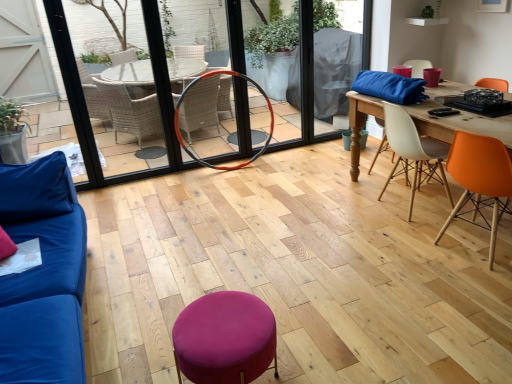
What do you see at coordinates (42, 275) in the screenshot? Image resolution: width=512 pixels, height=384 pixels. I see `blue fabric couch at left` at bounding box center [42, 275].

You are a GUI agent. You are given a task and a screenshot of the screen. Output one action in this format:
    pyautogui.click(x=<x>, y=<y>)
    Task: Click on the orange matte chair at right, which appears as the 2th chair when viewed from the back
    
    Given the screenshot: What is the action you would take?
    pyautogui.click(x=480, y=181)

What is the approximate width of orange matte chair at right, which appears as the 2th chair when viewed from the back?

orange matte chair at right, which appears as the 2th chair when viewed from the back, is 20.42 inches wide.

The image size is (512, 384). Describe the element at coordinates (413, 152) in the screenshot. I see `white plastic chair at center right, acting as the 1th chair starting from the back` at that location.

The image size is (512, 384). Describe the element at coordinates (119, 82) in the screenshot. I see `orange rubber hula hoop at center` at that location.

This screenshot has height=384, width=512. What are the coordinates of `blue fabric couch at left` in the screenshot? It's located at (42, 275).

From a real-world perspective, is purple fabric stool at center located beneath white plastic chair at center right, acting as the 1th chair starting from the back?

Indeed, from a real-world perspective, purple fabric stool at center is positioned beneath white plastic chair at center right, acting as the 1th chair starting from the back.

Considering the sizes of objects purple fabric stool at center and white plastic chair at center right, acting as the 1th chair starting from the back, in the image provided, who is wider, purple fabric stool at center or white plastic chair at center right, acting as the 1th chair starting from the back,?

Wider between the two is white plastic chair at center right, acting as the 1th chair starting from the back.

Considering the sizes of objects purple fabric stool at center and white plastic chair at center right, the second chair when ordered from front to back, in the image provided, who is shorter, purple fabric stool at center or white plastic chair at center right, the second chair when ordered from front to back,?

With less height is purple fabric stool at center.

From the picture: Who is bigger, purple fabric stool at center or white plastic chair at center right, the second chair when ordered from front to back?

With larger size is white plastic chair at center right, the second chair when ordered from front to back.

From the image's perspective, does orange matte chair at right, the first chair in the front-to-back sequence, appear higher than white plastic chair at center right, the second chair when ordered from front to back?

No.

What's the angular difference between orange matte chair at right, the first chair in the front-to-back sequence, and white plastic chair at center right, acting as the 1th chair starting from the back,'s facing directions?

17.6 degrees.

How much distance is there between orange matte chair at right, which appears as the 2th chair when viewed from the back, and white plastic chair at center right, acting as the 1th chair starting from the back?

A distance of 19.24 inches exists between orange matte chair at right, which appears as the 2th chair when viewed from the back, and white plastic chair at center right, acting as the 1th chair starting from the back.

Between orange matte chair at right, the first chair in the front-to-back sequence, and white plastic chair at center right, acting as the 1th chair starting from the back, which one has smaller size?

With smaller size is orange matte chair at right, the first chair in the front-to-back sequence.

Is purple fabric stool at center facing away from orange matte chair at right, the first chair in the front-to-back sequence?

purple fabric stool at center does not have its back to orange matte chair at right, the first chair in the front-to-back sequence.

Which object is positioned more to the left, purple fabric stool at center or orange matte chair at right, the first chair in the front-to-back sequence?

Positioned to the left is purple fabric stool at center.

From the image's perspective, who appears lower, purple fabric stool at center or orange matte chair at right, the first chair in the front-to-back sequence?

purple fabric stool at center.

Can you confirm if purple fabric stool at center is wider than orange matte chair at right, the first chair in the front-to-back sequence?

No.

Find the location of a particular element. The height and width of the screenshot is (384, 512). screen door behind the blue fabric couch at left is located at coordinates (119, 82).

Considering the positions of objects orange rubber hula hoop at center and blue fabric couch at left in the image provided, who is behind, orange rubber hula hoop at center or blue fabric couch at left?

orange rubber hula hoop at center is further from the camera.

Is orange rubber hula hoop at center taller or shorter than blue fabric couch at left?

orange rubber hula hoop at center is taller than blue fabric couch at left.

Is orange rubber hula hoop at center facing away from blue fabric couch at left?

No, blue fabric couch at left is not at the back of orange rubber hula hoop at center.

Considering the sizes of objects orange matte chair at right, the first chair in the front-to-back sequence, and orange rubber hula hoop at center in the image provided, who is shorter, orange matte chair at right, the first chair in the front-to-back sequence, or orange rubber hula hoop at center?

With less height is orange matte chair at right, the first chair in the front-to-back sequence.

Is orange matte chair at right, which appears as the 2th chair when viewed from the back, to the left of orange rubber hula hoop at center from the viewer's perspective?

No, orange matte chair at right, which appears as the 2th chair when viewed from the back, is not to the left of orange rubber hula hoop at center.

How different are the orientations of orange matte chair at right, the first chair in the front-to-back sequence, and orange rubber hula hoop at center in degrees?

They differ by 104 degrees in their facing directions.

From a real-world perspective, is orange matte chair at right, which appears as the 2th chair when viewed from the back, positioned above or below orange rubber hula hoop at center?

In terms of real-world spatial position, orange matte chair at right, which appears as the 2th chair when viewed from the back, is below orange rubber hula hoop at center.

In the image, is orange rubber hula hoop at center positioned in front of or behind purple fabric stool at center?

In the image, orange rubber hula hoop at center appears behind purple fabric stool at center.

Is orange rubber hula hoop at center at the left side of purple fabric stool at center?

Correct, you'll find orange rubber hula hoop at center to the left of purple fabric stool at center.

Is purple fabric stool at center inside orange rubber hula hoop at center?

Actually, purple fabric stool at center is outside orange rubber hula hoop at center.

Is orange rubber hula hoop at center not close to purple fabric stool at center?

orange rubber hula hoop at center is positioned a significant distance from purple fabric stool at center.

How many degrees apart are the facing directions of purple fabric stool at center and orange rubber hula hoop at center?

The angle between the facing direction of purple fabric stool at center and the facing direction of orange rubber hula hoop at center is 87.8 degrees.

Is purple fabric stool at center oriented towards orange rubber hula hoop at center?

No.

Is the depth of purple fabric stool at center greater than that of orange rubber hula hoop at center?

No.

At what (x,y) coordinates should I click in order to perform the action: click on bar stool that appears below the white plastic chair at center right, acting as the 1th chair starting from the back (from a real-world perspective). Please return your answer as a coordinate pair (x, y). This screenshot has height=384, width=512. Looking at the image, I should click on (225, 339).

The height and width of the screenshot is (384, 512). In order to click on chair above the orange matte chair at right, the first chair in the front-to-back sequence (from the image's perspective) in this screenshot , I will do `click(413, 152)`.

From the picture: Considering their positions, is orange matte chair at right, the first chair in the front-to-back sequence, positioned closer to blue fabric couch at left than white plastic chair at center right, the second chair when ordered from front to back?

The object closer to blue fabric couch at left is orange matte chair at right, the first chair in the front-to-back sequence.

Looking at this image, looking at the image, which one is located further to orange matte chair at right, which appears as the 2th chair when viewed from the back, orange rubber hula hoop at center or purple fabric stool at center?

orange rubber hula hoop at center is positioned further to the anchor orange matte chair at right, which appears as the 2th chair when viewed from the back.

Considering their positions, is blue fabric couch at left positioned further to orange rubber hula hoop at center than purple fabric stool at center?

Among the two, purple fabric stool at center is located further to orange rubber hula hoop at center.

When comparing their distances from orange rubber hula hoop at center, does white plastic chair at center right, acting as the 1th chair starting from the back, or orange matte chair at right, the first chair in the front-to-back sequence, seem further?

orange matte chair at right, the first chair in the front-to-back sequence, is positioned further to the anchor orange rubber hula hoop at center.

When comparing their distances from white plastic chair at center right, acting as the 1th chair starting from the back, does orange rubber hula hoop at center or orange matte chair at right, the first chair in the front-to-back sequence, seem closer?

orange matte chair at right, the first chair in the front-to-back sequence, is closer to white plastic chair at center right, acting as the 1th chair starting from the back.

Looking at the image, which one is located closer to orange rubber hula hoop at center, orange matte chair at right, which appears as the 2th chair when viewed from the back, or white plastic chair at center right, acting as the 1th chair starting from the back?

white plastic chair at center right, acting as the 1th chair starting from the back.

Estimate the real-world distances between objects in this image. Which object is closer to orange matte chair at right, the first chair in the front-to-back sequence, white plastic chair at center right, acting as the 1th chair starting from the back, or orange rubber hula hoop at center?

white plastic chair at center right, acting as the 1th chair starting from the back, is closer to orange matte chair at right, the first chair in the front-to-back sequence.

Considering their positions, is blue fabric couch at left positioned further to purple fabric stool at center than orange rubber hula hoop at center?

orange rubber hula hoop at center is further to purple fabric stool at center.

This screenshot has height=384, width=512. Identify the location of bar stool between blue fabric couch at left and orange rubber hula hoop at center along the z-axis. (225, 339).

The height and width of the screenshot is (384, 512). I want to click on armchair between orange rubber hula hoop at center and orange matte chair at right, which appears as the 2th chair when viewed from the back, from left to right, so (179, 119).

I want to click on chair situated between purple fabric stool at center and orange matte chair at right, which appears as the 2th chair when viewed from the back, from left to right, so tap(413, 152).

Locate an element on the screen. The height and width of the screenshot is (384, 512). screen door located between blue fabric couch at left and orange matte chair at right, the first chair in the front-to-back sequence, in the left-right direction is located at coordinates (119, 82).